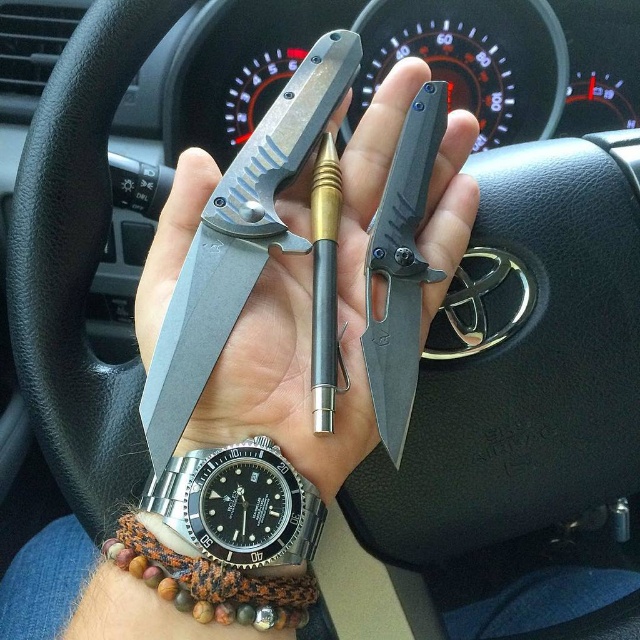
Does matte black knife at center have a greater width compared to black matte knife at center?

Yes.

Is point (314, 129) closer to camera compared to point (374, 408)?

No, (314, 129) is behind (374, 408).

Does point (298, 120) lie behind point (387, 436)?

Yes, point (298, 120) is behind point (387, 436).

What are the coordinates of `matte black knife at center` in the screenshot? It's located at (237, 241).

Identify the location of matte black knife at center. The height and width of the screenshot is (640, 640). (237, 241).

Does matte black knife at center lie in front of satin steel watch at lower left?

No, matte black knife at center is behind satin steel watch at lower left.

Is point (205, 209) behind point (244, 496)?

Yes.

I want to click on matte black knife at center, so (237, 241).

Which is in front, point (170, 524) or point (401, 186)?

Point (170, 524) is more forward.

Who is more distant from viewer, (x=220, y=513) or (x=410, y=317)?

Point (x=410, y=317)

Image resolution: width=640 pixels, height=640 pixels. Find the location of `satin steel watch at lower left`. satin steel watch at lower left is located at coordinates (236, 508).